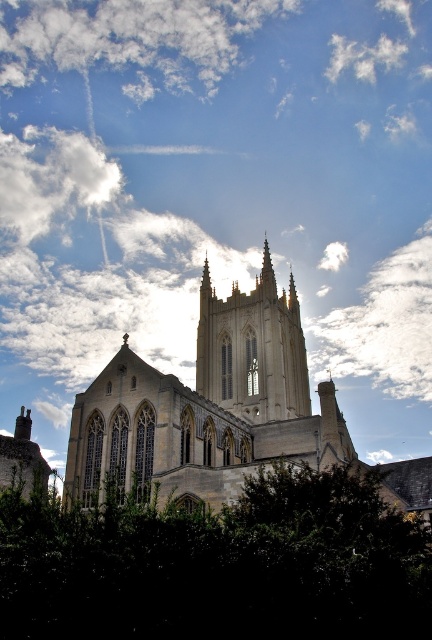
Consider the image. You are an architect analyzing the cathedral. From your perspective, which object occupies more horizontal space in the image between the golden stone church at center and the white fluffy cloud at upper right?

The golden stone church at center occupies more horizontal space than the white fluffy cloud at upper right because its width surpasses the cloud.

You are standing in front of the cathedral and notice a point marked at coordinates (x=219, y=564). Based on the scene description, what object is located at that point?

The point at coordinates (x=219, y=564) corresponds to the green leafy tree at lower center.

You are an architect analyzing the cathedral design. From your observation point, does the golden stone church at center block the view of the white fluffy cloud at upper center?

The golden stone church at center is in front of the white fluffy cloud at upper center, so it blocks the view of the white fluffy cloud at upper center from your observation point.